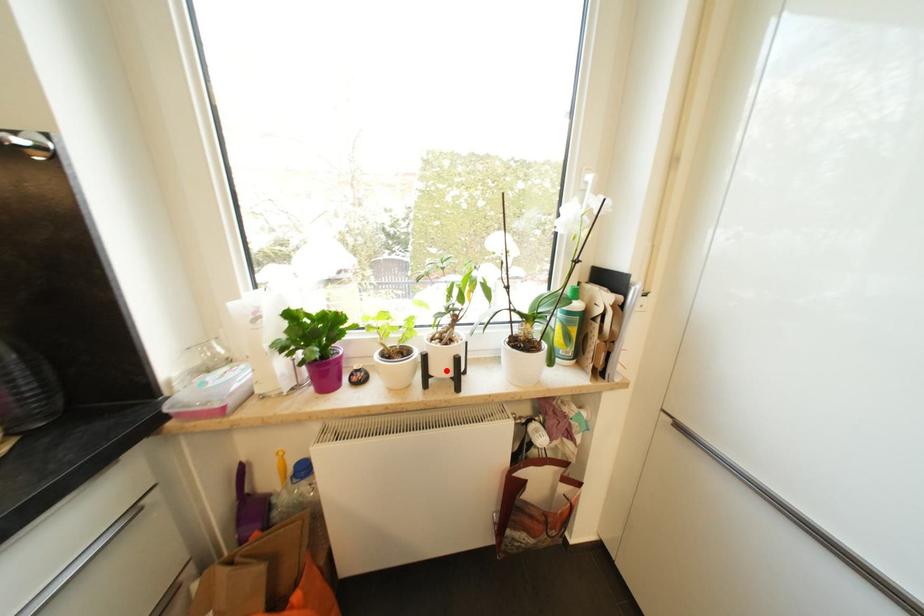
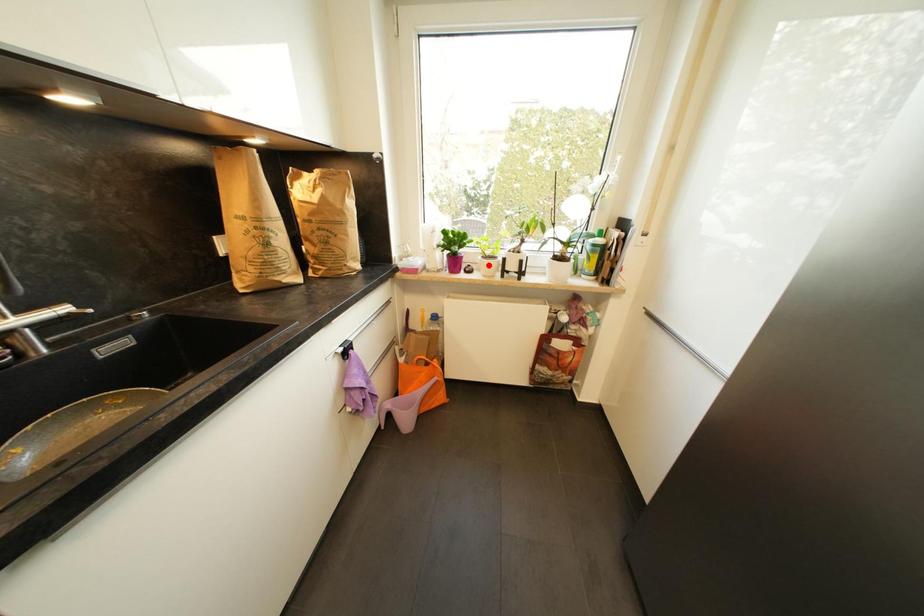
I am providing you with two images of the same scene from different viewpoints. A red point is marked on the first image and another point is marked on the second image. Do the highlighted points in image1 and image2 indicate the same real-world spot?

No